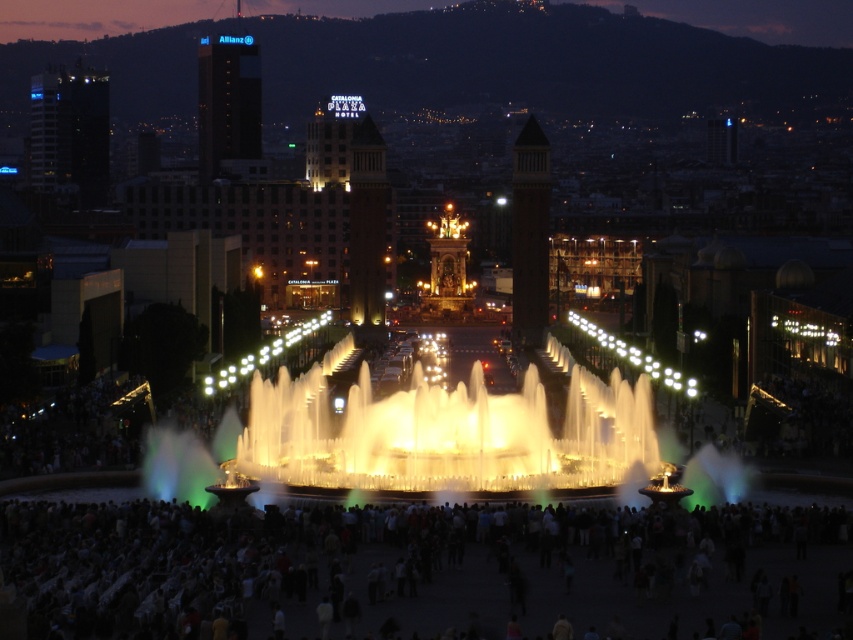
Between dark gray crowd at center and illuminated water at center, which one is positioned lower?

dark gray crowd at center is lower down.

Does dark gray crowd at center have a greater height compared to illuminated water at center?

In fact, dark gray crowd at center may be shorter than illuminated water at center.

Who is more distant from viewer, (x=759, y=600) or (x=293, y=419)?

The point (x=293, y=419) is more distant.

At what (x,y) coordinates should I click in order to perform the action: click on dark gray crowd at center. Please return your answer as a coordinate pair (x, y). Looking at the image, I should click on (387, 570).